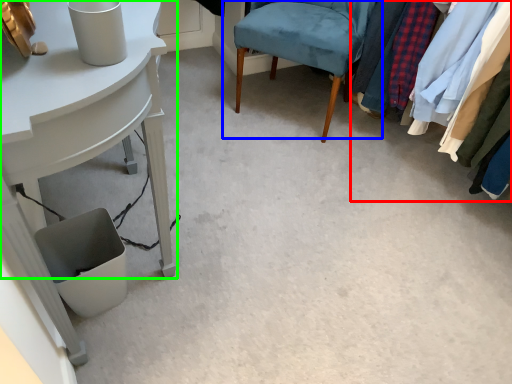
Question: Which object is positioned closest to closet (highlighted by a red box)? Select from chair (highlighted by a blue box) and table (highlighted by a green box).

Choices:
 (A) chair
 (B) table

Answer: (A)